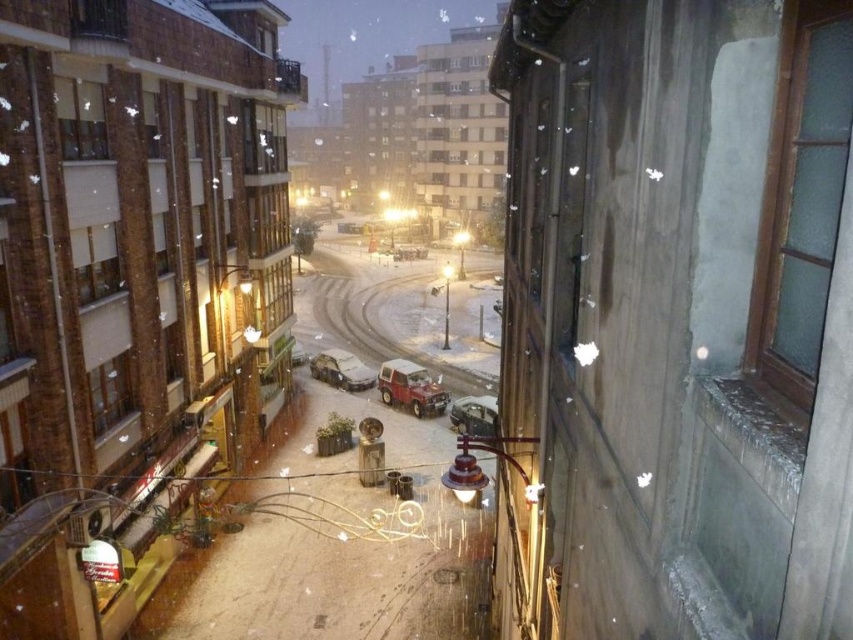
Question: Which object is positioned farthest from the metallic red car at center?

Choices:
 (A) metallic silver car at center
 (B) sleek metallic car at center
 (C) sandy concrete alley at center

Answer: (C)

Question: Among these points, which one is nearest to the camera?

Choices:
 (A) (453, 298)
 (B) (410, 378)

Answer: (B)

Question: Is sleek metallic car at center to the right of metallic silver car at center from the viewer's perspective?

Choices:
 (A) no
 (B) yes

Answer: (A)

Question: Does metallic red car at center have a lesser width compared to metallic silver car at center?

Choices:
 (A) no
 (B) yes

Answer: (A)

Question: Which of the following is the closest to the observer?

Choices:
 (A) (383, 369)
 (B) (326, 380)

Answer: (A)

Question: Considering the relative positions of sandy concrete alley at center and sleek metallic car at center in the image provided, where is sandy concrete alley at center located with respect to sleek metallic car at center?

Choices:
 (A) above
 (B) below

Answer: (A)